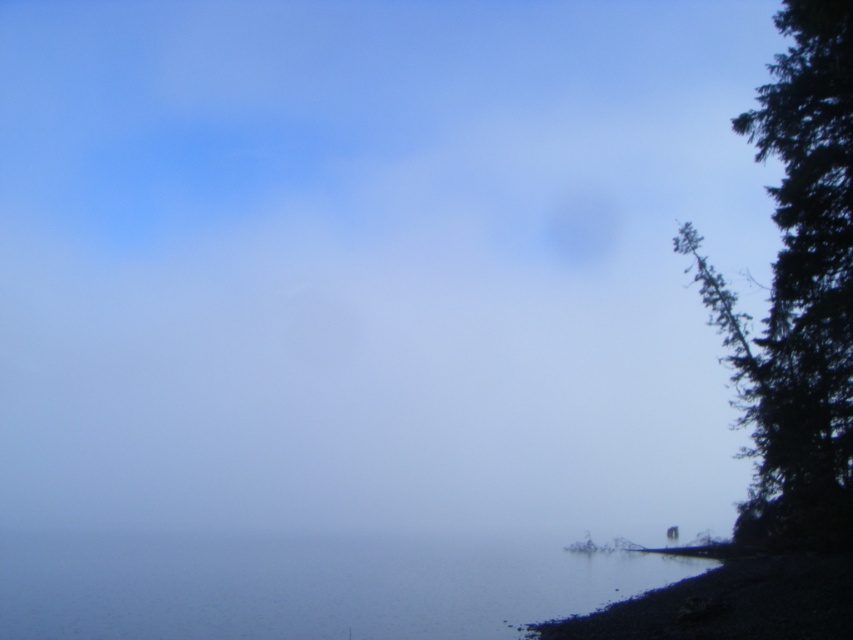
Is dark green textured tree at right wider than smooth pebbles at lower right?

Correct, the width of dark green textured tree at right exceeds that of smooth pebbles at lower right.

Can you confirm if dark green textured tree at right is positioned to the left of smooth pebbles at lower right?

No, dark green textured tree at right is not to the left of smooth pebbles at lower right.

Describe the element at coordinates (798, 291) in the screenshot. I see `dark green textured tree at right` at that location.

Where is `dark green textured tree at right`? dark green textured tree at right is located at coordinates (798, 291).

Who is shorter, clear water at lower right or dark green textured tree at right?

clear water at lower right

Is point (376, 577) behind point (693, 252)?

Yes.

Measure the distance between point (287, 568) and camera.

They are 79.75 meters apart.

The width and height of the screenshot is (853, 640). Find the location of `clear water at lower right`. clear water at lower right is located at coordinates (306, 586).

Can you confirm if clear water at lower right is bigger than smooth pebbles at lower right?

Yes, clear water at lower right is bigger than smooth pebbles at lower right.

Is clear water at lower right to the left of smooth pebbles at lower right from the viewer's perspective?

Indeed, clear water at lower right is positioned on the left side of smooth pebbles at lower right.

Is point (654, 568) positioned behind point (773, 566)?

Yes, it is behind point (773, 566).

Locate an element on the screen. This screenshot has height=640, width=853. clear water at lower right is located at coordinates (306, 586).